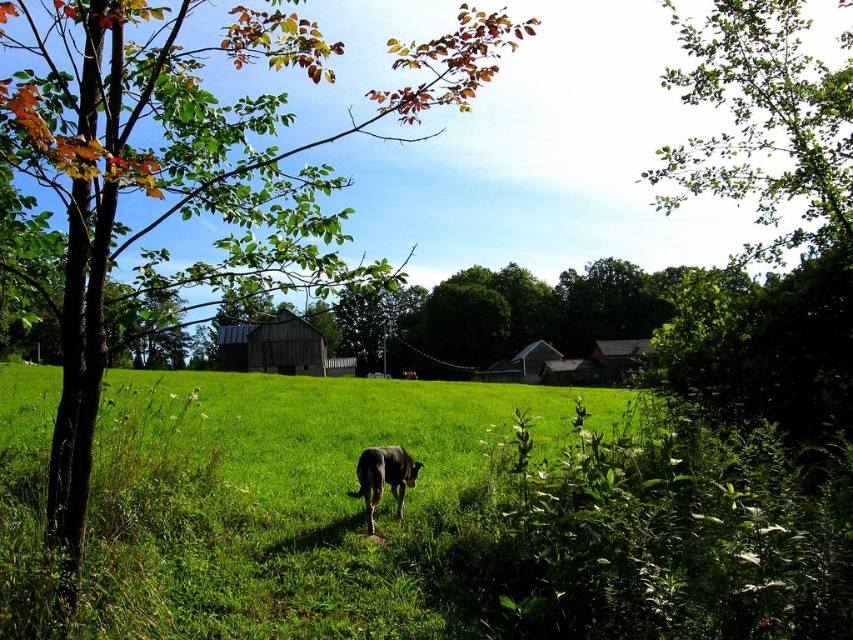
Question: Which is farther from the dark brown wooden barn at center?

Choices:
 (A) green leafy tree at upper right
 (B) brown fur dog at center
 (C) green leafy tree at center

Answer: (B)

Question: Can you confirm if green leafy tree at upper right is positioned above dark brown wooden barn at center?

Choices:
 (A) no
 (B) yes

Answer: (B)

Question: Which point is farther to the camera?

Choices:
 (A) (828, 118)
 (B) (332, 368)

Answer: (B)

Question: Which point is farther to the camera?

Choices:
 (A) dark brown wooden barn at center
 (B) green leafy tree at upper right
 (C) brown fur dog at center
 (D) green leafy tree at center

Answer: (A)

Question: Does green leafy tree at center appear on the right side of green leafy tree at upper right?

Choices:
 (A) yes
 (B) no

Answer: (B)

Question: Is dark brown wooden barn at center smaller than brown fur dog at center?

Choices:
 (A) yes
 (B) no

Answer: (B)